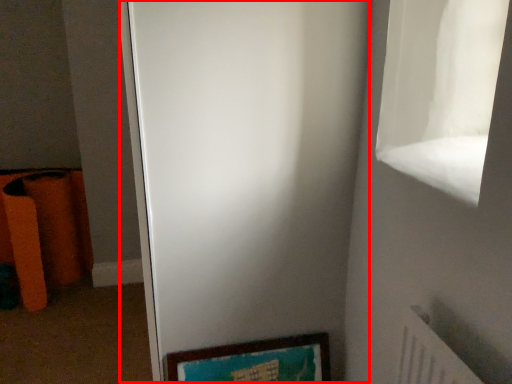
Question: From the image's perspective, considering the relative positions of screen door (annotated by the red box) and picture frame in the image provided, where is screen door (annotated by the red box) located with respect to the staircase?

Choices:
 (A) below
 (B) above

Answer: (B)